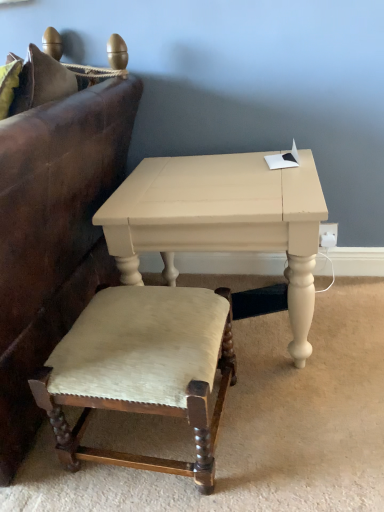
Question: From the image's perspective, is velvet upholstered stool at lower left on leather couch at left?

Choices:
 (A) no
 (B) yes

Answer: (A)

Question: Does velvet upholstered stool at lower left come behind leather couch at left?

Choices:
 (A) yes
 (B) no

Answer: (A)

Question: From the image's perspective, is velvet upholstered stool at lower left under leather couch at left?

Choices:
 (A) no
 (B) yes

Answer: (B)

Question: Is velvet upholstered stool at lower left touching leather couch at left?

Choices:
 (A) yes
 (B) no

Answer: (B)

Question: Is velvet upholstered stool at lower left wider than leather couch at left?

Choices:
 (A) no
 (B) yes

Answer: (A)

Question: Would you consider velvet upholstered stool at lower left to be distant from leather couch at left?

Choices:
 (A) yes
 (B) no

Answer: (B)

Question: Can we say matte white table at center lies outside leather couch at left?

Choices:
 (A) yes
 (B) no

Answer: (A)

Question: Does matte white table at center have a smaller size compared to leather couch at left?

Choices:
 (A) no
 (B) yes

Answer: (B)

Question: Considering the relative sizes of matte white table at center and leather couch at left in the image provided, is matte white table at center thinner than leather couch at left?

Choices:
 (A) no
 (B) yes

Answer: (B)

Question: From the image's perspective, does matte white table at center appear lower than leather couch at left?

Choices:
 (A) no
 (B) yes

Answer: (B)

Question: Can you confirm if matte white table at center is taller than leather couch at left?

Choices:
 (A) no
 (B) yes

Answer: (A)

Question: Is there a large distance between matte white table at center and leather couch at left?

Choices:
 (A) yes
 (B) no

Answer: (B)

Question: Is leather couch at left looking in the opposite direction of matte white table at center?

Choices:
 (A) no
 (B) yes

Answer: (A)